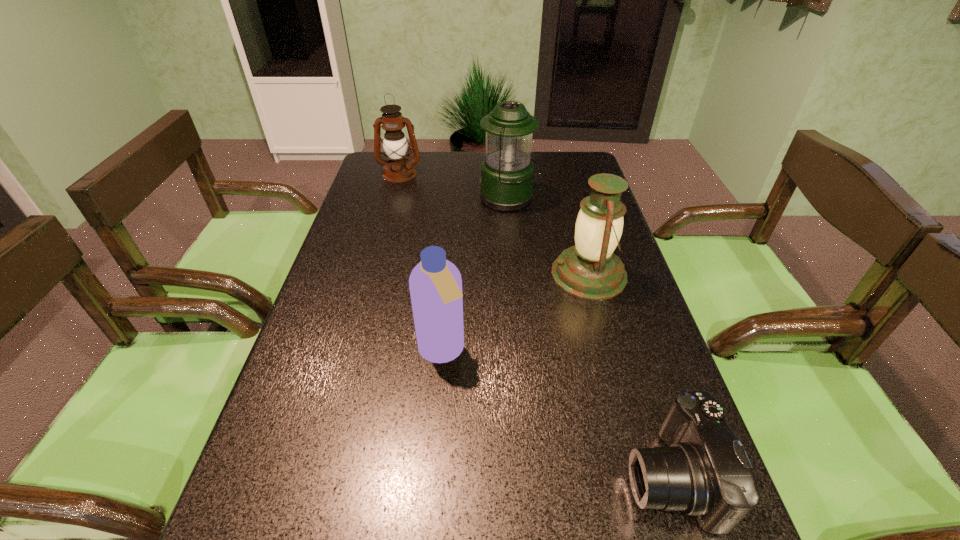
This screenshot has height=540, width=960. Identify the location of object that is at the far left corner. (398, 169).

In the image, there is a desktop. In order to click on vacant region at the far edge in this screenshot , I will do `click(436, 174)`.

In the image, there is a desktop. Where is `free space at the left edge`? Image resolution: width=960 pixels, height=540 pixels. free space at the left edge is located at coordinates (265, 506).

Find the location of `free point at the right edge`. free point at the right edge is located at coordinates (657, 433).

At what (x,y) coordinates should I click in order to perform the action: click on vacant space at the far right corner of the desktop. Please return your answer as a coordinate pair (x, y). Looking at the image, I should click on (570, 172).

You are a GUI agent. You are given a task and a screenshot of the screen. Output one action in this format:
    pyautogui.click(x=<x>, y=<y>)
    Task: Click on the unoccupied position between the shortest object and the second farthest object
    
    Given the screenshot: What is the action you would take?
    pyautogui.click(x=589, y=337)

This screenshot has height=540, width=960. What are the coordinates of `vacant area that lies between the third farthest object and the second farthest object` in the screenshot? It's located at (549, 237).

Locate an element on the screen. The image size is (960, 540). empty space between the nearest lantern and the farthest lantern is located at coordinates pos(494,224).

The image size is (960, 540). In order to click on unoccupied area between the second farthest object and the shampoo in this screenshot , I will do `click(475, 275)`.

Image resolution: width=960 pixels, height=540 pixels. I want to click on free area in between the farthest object and the third nearest object, so click(x=494, y=224).